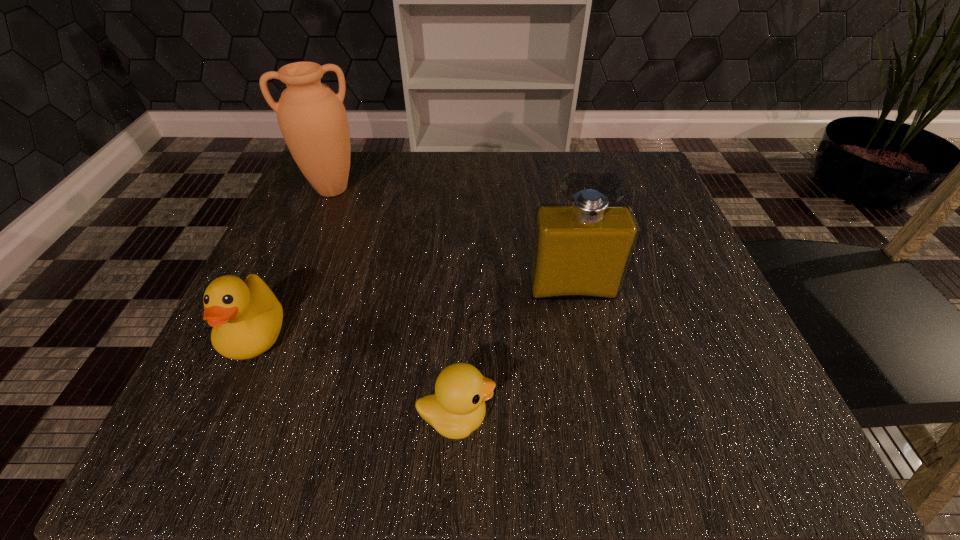
This screenshot has width=960, height=540. Identify the location of free space located at the beak of the left duck. (227, 401).

This screenshot has width=960, height=540. I want to click on free region located 0.230m on the face of the nearer duck, so click(674, 418).

At what (x,y) coordinates should I click in order to perform the action: click on object that is at the far edge. Please return your answer as a coordinate pair (x, y). The image size is (960, 540). Looking at the image, I should click on (312, 118).

Identify the location of object that is at the near edge. This screenshot has width=960, height=540. (457, 408).

Locate an element on the screen. urn that is at the left edge is located at coordinates (312, 118).

You are a GUI agent. You are given a task and a screenshot of the screen. Output one action in this format:
    pyautogui.click(x=<x>, y=<y>)
    Task: Click on the duck located in the left edge section of the desktop
    The image size is (960, 540).
    Given the screenshot: What is the action you would take?
    pyautogui.click(x=246, y=318)

At what (x,y) coordinates should I click in order to perform the action: click on object that is at the right edge. Please return your answer as a coordinate pair (x, y). Looking at the image, I should click on (581, 251).

Where is `object present at the far left corner`? object present at the far left corner is located at coordinates (312, 118).

Locate an element on the screen. Image resolution: width=960 pixels, height=540 pixels. vacant space at the far edge of the desktop is located at coordinates (521, 168).

Where is `free spot at the left edge of the desktop`? The width and height of the screenshot is (960, 540). free spot at the left edge of the desktop is located at coordinates click(359, 246).